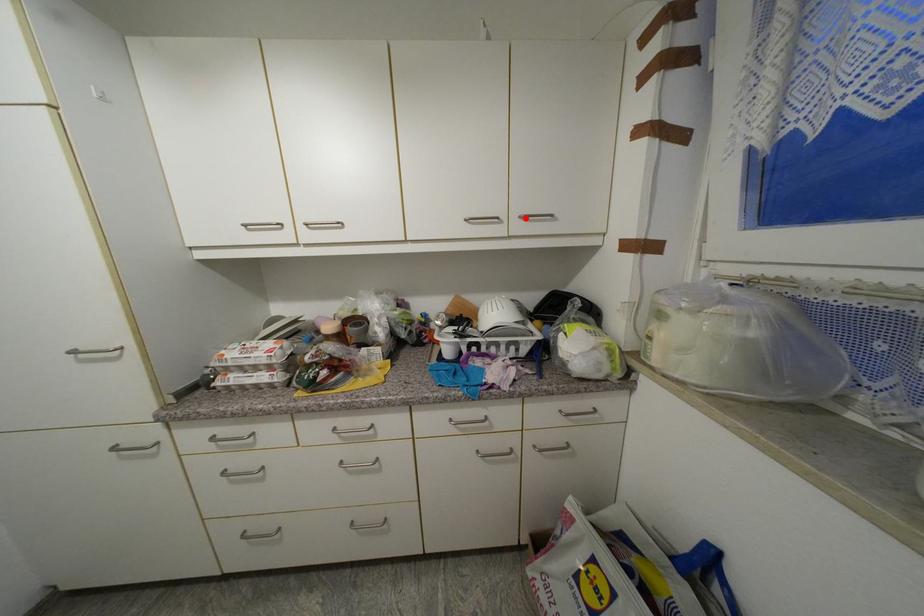
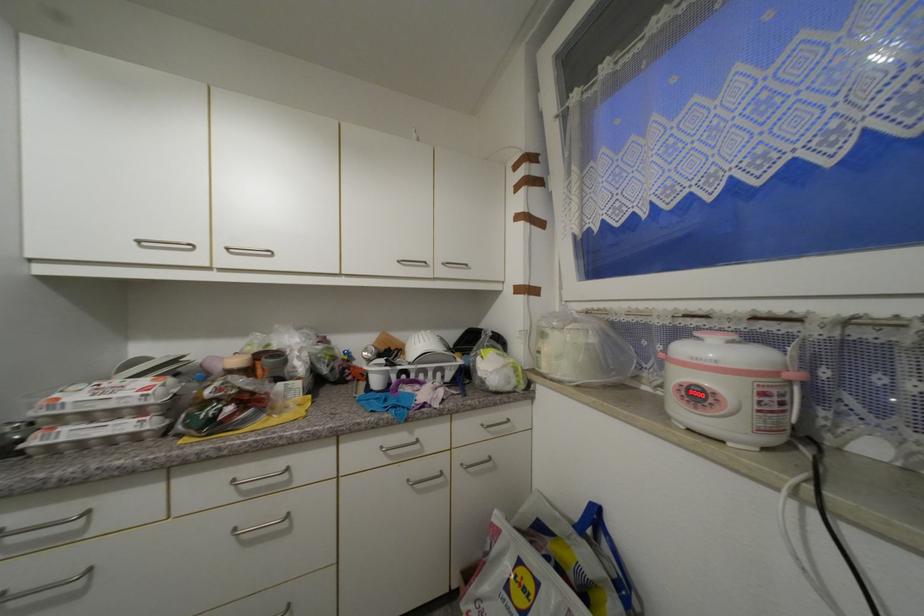
The point at the highlighted location is marked in the first image. Where is the corresponding point in the second image?

(448, 265)